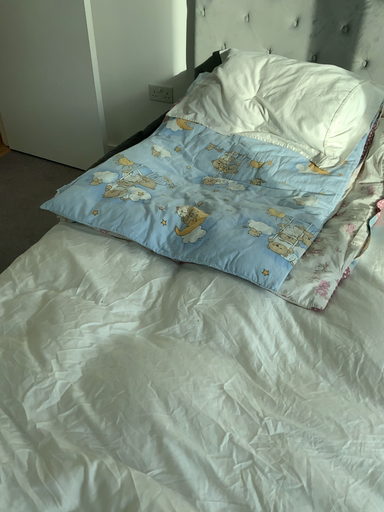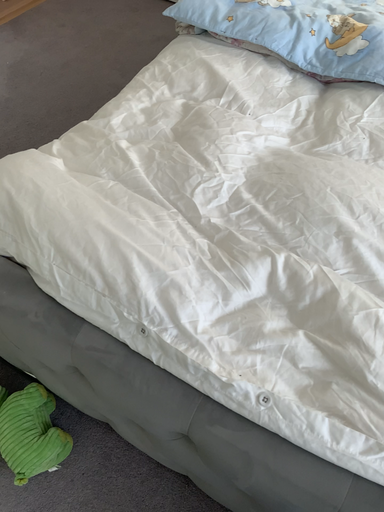
Question: How did the camera likely rotate when shooting the video?

Choices:
 (A) rotated upward
 (B) rotated downward

Answer: (B)